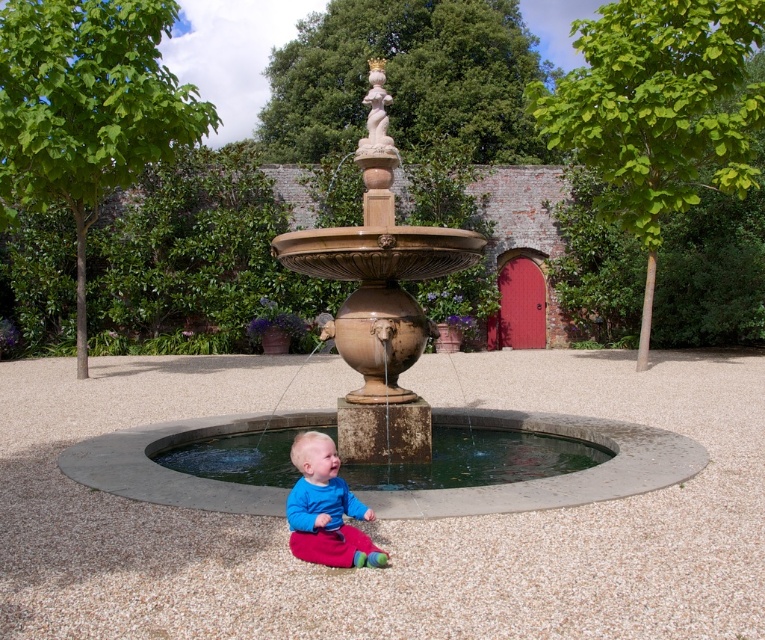
Looking at this image, does smooth gravel at center have a greater height compared to white stone statue at upper center?

No, smooth gravel at center is not taller than white stone statue at upper center.

Describe the element at coordinates (386, 522) in the screenshot. The height and width of the screenshot is (640, 765). I see `smooth gravel at center` at that location.

Where is `smooth gravel at center`? smooth gravel at center is located at coordinates (386, 522).

Is smooth gravel at center below bronze fountain at center?

Yes.

Which is in front, point (254, 566) or point (659, 454)?

Positioned in front is point (254, 566).

Locate an element on the screen. smooth gravel at center is located at coordinates (386, 522).

Which is more to the right, blue soft fabric baby at center or white stone statue at upper center?

From the viewer's perspective, blue soft fabric baby at center appears more on the right side.

Which is more to the left, blue soft fabric baby at center or white stone statue at upper center?

From the viewer's perspective, white stone statue at upper center appears more on the left side.

Where is `blue soft fabric baby at center`? Image resolution: width=765 pixels, height=640 pixels. blue soft fabric baby at center is located at coordinates (324, 508).